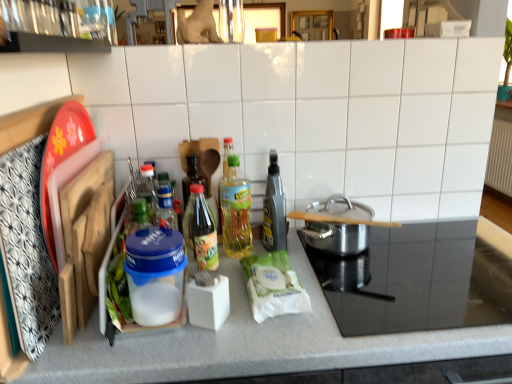
Where is `free space in front of metallic gray spray bottle at center, positioned as the 1th bottle in right-to-left order`? free space in front of metallic gray spray bottle at center, positioned as the 1th bottle in right-to-left order is located at coordinates (303, 279).